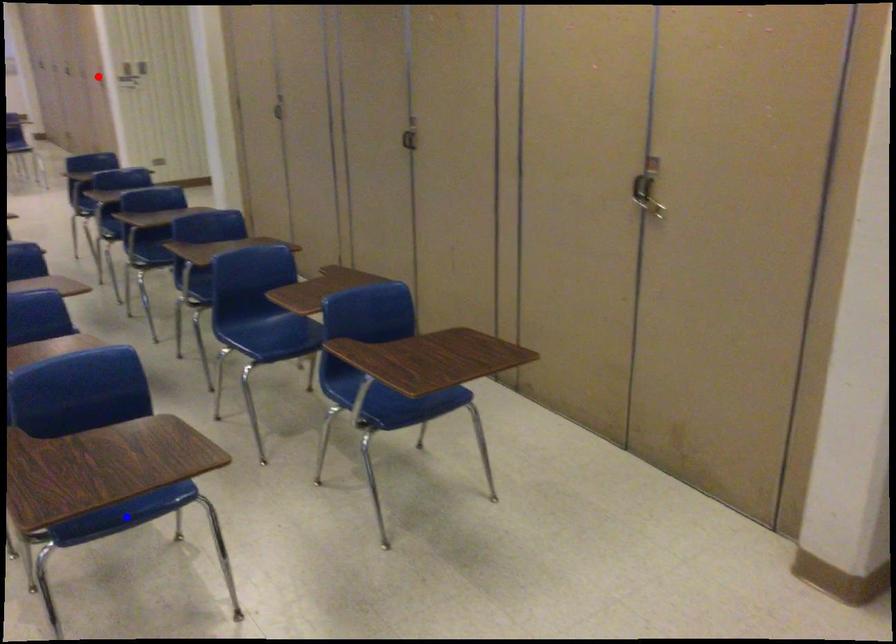
Question: Which of the two points in the image is closer to the camera?

Choices:
 (A) Blue point is closer.
 (B) Red point is closer.

Answer: (A)